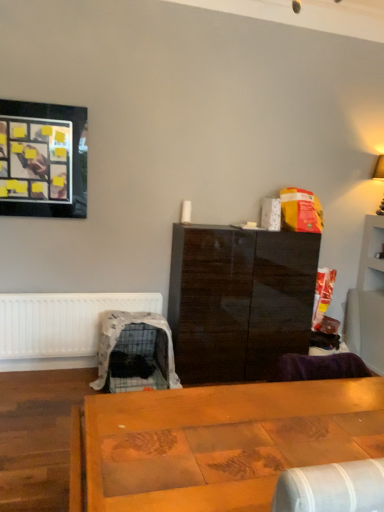
Question: In terms of width, does glossy dark wood cabinet at center look wider or thinner when compared to plastic covered pet crate at lower left?

Choices:
 (A) thin
 (B) wide

Answer: (A)

Question: Is glossy dark wood cabinet at center bigger or smaller than plastic covered pet crate at lower left?

Choices:
 (A) big
 (B) small

Answer: (A)

Question: Estimate the real-world distances between objects in this image. Which object is farther from the white matte radiator at lower left?

Choices:
 (A) wooden table at center
 (B) plastic covered pet crate at lower left
 (C) glossy dark wood cabinet at center
 (D) black glossy picture frame at upper left

Answer: (A)

Question: Estimate the real-world distances between objects in this image. Which object is closer to the plastic covered pet crate at lower left?

Choices:
 (A) black glossy picture frame at upper left
 (B) white matte radiator at lower left
 (C) wooden table at center
 (D) glossy dark wood cabinet at center

Answer: (B)